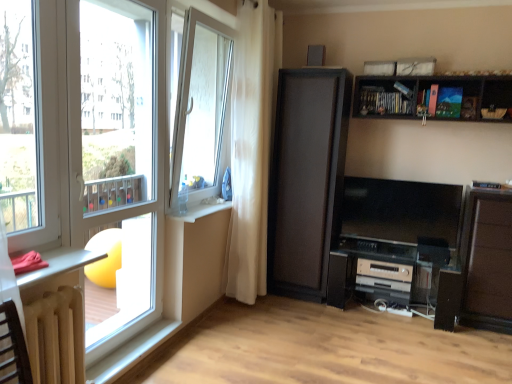
Question: Is white glass window at center, which appears as the second window when viewed from the left, touching metallic silver table at lower left, positioned as the 1th table in top-to-bottom order?

Choices:
 (A) yes
 (B) no

Answer: (B)

Question: Is white glass window at center, marked as the first window in a back-to-front arrangement, aimed at metallic silver table at lower left, positioned as the 1th table in top-to-bottom order?

Choices:
 (A) no
 (B) yes

Answer: (A)

Question: Does white glass window at center, marked as the first window in a back-to-front arrangement, have a smaller size compared to metallic silver table at lower left, positioned as the 1th table in top-to-bottom order?

Choices:
 (A) no
 (B) yes

Answer: (A)

Question: Is white glass window at center, the 1th window when ordered from right to left, shorter than metallic silver table at lower left, positioned as the 1th table in top-to-bottom order?

Choices:
 (A) no
 (B) yes

Answer: (A)

Question: Considering the relative positions of white glass window at center, the 2th window from the front, and metallic silver table at lower left, positioned as the 1th table in top-to-bottom order, in the image provided, is white glass window at center, the 2th window from the front, to the right of metallic silver table at lower left, positioned as the 1th table in top-to-bottom order, from the viewer's perspective?

Choices:
 (A) no
 (B) yes

Answer: (B)

Question: Are white glass window at center, the 1th window when ordered from right to left, and metallic silver table at lower left, positioned as the 1th table in top-to-bottom order, located far from each other?

Choices:
 (A) yes
 (B) no

Answer: (A)

Question: Does white plastic window at left, the first window in the left-to-right sequence, have a greater height compared to white plastic window frame at left?

Choices:
 (A) no
 (B) yes

Answer: (A)

Question: Can you confirm if white plastic window at left, the first window in the left-to-right sequence, is shorter than white plastic window frame at left?

Choices:
 (A) yes
 (B) no

Answer: (A)

Question: Is white plastic window at left, the 2th window when ordered from right to left, positioned behind white plastic window frame at left?

Choices:
 (A) no
 (B) yes

Answer: (A)

Question: Is white plastic window frame at left inside white plastic window at left, the first window in the left-to-right sequence?

Choices:
 (A) yes
 (B) no

Answer: (B)

Question: Is white plastic window at left, the 2th window when ordered from right to left, looking in the opposite direction of white plastic window frame at left?

Choices:
 (A) yes
 (B) no

Answer: (B)

Question: From the image's perspective, is white plastic window at left, the 2th window when ordered from right to left, over white plastic window frame at left?

Choices:
 (A) yes
 (B) no

Answer: (A)

Question: Is metallic silver table at lower left, positioned as the 1th table in top-to-bottom order, shorter than wooden dark brown shelf at upper right?

Choices:
 (A) yes
 (B) no

Answer: (A)